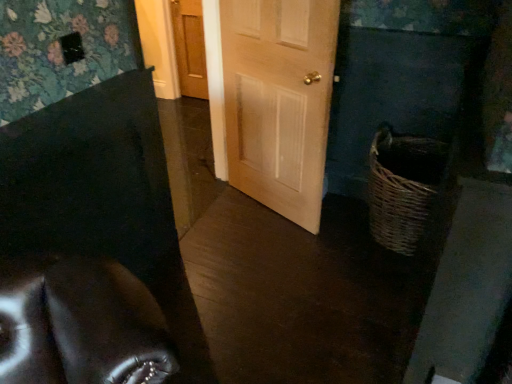
Find the location of a particular element. The height and width of the screenshot is (384, 512). free space that is to the left of light wood door at center, which is the second door from left to right is located at coordinates (229, 225).